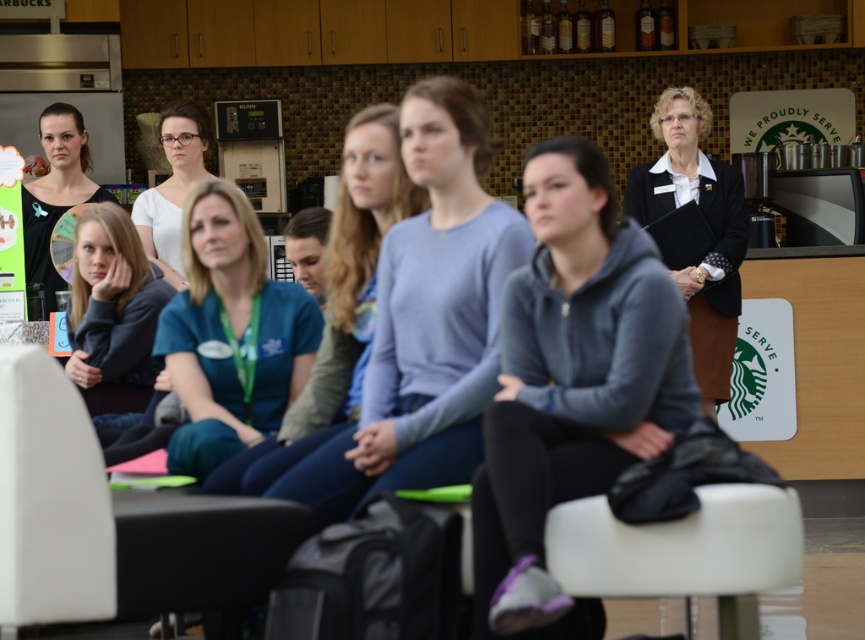
Question: Considering the real-world distances, which object is farthest from the white leather chair at center?

Choices:
 (A) matte white shirt at center
 (B) teal fabric shirt at center
 (C) gray fleece hoodie at center
 (D) black matte blazer at upper right

Answer: (D)

Question: Does black matte blazer at upper right have a lesser width compared to matte black shirt at left?

Choices:
 (A) no
 (B) yes

Answer: (A)

Question: Estimate the real-world distances between objects in this image. Which object is closer to the matte gray hoodie at center?

Choices:
 (A) gray fleece hoodie at center
 (B) black matte blazer at upper right
 (C) white leather chair at center
 (D) matte black shirt at left

Answer: (D)

Question: Does white leather chair at center have a lesser width compared to teal fabric shirt at center?

Choices:
 (A) no
 (B) yes

Answer: (A)

Question: Where is light blue sweater at center located in relation to matte gray hoodie at center in the image?

Choices:
 (A) below
 (B) above

Answer: (B)

Question: Which object is the closest to the matte black shirt at left?

Choices:
 (A) black matte blazer at upper right
 (B) matte gray hoodie at center
 (C) light blue sweater at center
 (D) gray fleece hoodie at center

Answer: (B)